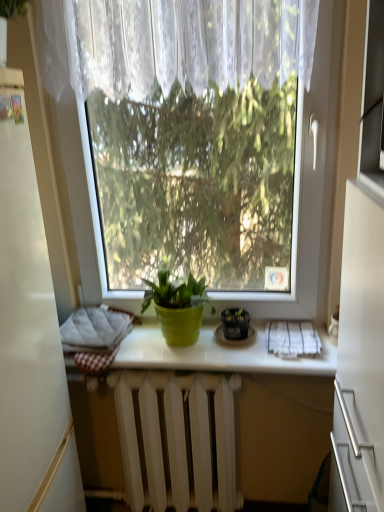
Question: Which direction should I rotate to face green matte pot at center, which is the 1th houseplant from left to right, — up or down?

Choices:
 (A) up
 (B) down

Answer: (B)

Question: Can you confirm if white textured cloth at lower right is taller than green matte pot at center, which is the 1th houseplant from left to right?

Choices:
 (A) yes
 (B) no

Answer: (B)

Question: Does white textured cloth at lower right have a larger size compared to green matte pot at center, which is counted as the second houseplant, starting from the right?

Choices:
 (A) yes
 (B) no

Answer: (B)

Question: Is white textured cloth at lower right in front of green matte pot at center, which is counted as the second houseplant, starting from the right?

Choices:
 (A) no
 (B) yes

Answer: (A)

Question: Is white textured cloth at lower right facing towards green matte pot at center, which is counted as the second houseplant, starting from the right?

Choices:
 (A) no
 (B) yes

Answer: (A)

Question: From the image's perspective, is white textured cloth at lower right on top of green matte pot at center, which is the 1th houseplant from left to right?

Choices:
 (A) yes
 (B) no

Answer: (B)

Question: Can you confirm if white textured cloth at lower right is positioned to the left of green matte pot at center, which is counted as the second houseplant, starting from the right?

Choices:
 (A) yes
 (B) no

Answer: (B)

Question: From a real-world perspective, is white painted metal radiator at center beneath green matte pot at center, which is counted as the second houseplant, starting from the right?

Choices:
 (A) no
 (B) yes

Answer: (B)

Question: Considering the relative positions of white painted metal radiator at center and green matte pot at center, which is the 1th houseplant from left to right, in the image provided, is white painted metal radiator at center in front of green matte pot at center, which is the 1th houseplant from left to right,?

Choices:
 (A) yes
 (B) no

Answer: (B)

Question: Can you confirm if white painted metal radiator at center is bigger than green matte pot at center, which is the 1th houseplant from left to right?

Choices:
 (A) yes
 (B) no

Answer: (A)

Question: Is the position of white painted metal radiator at center more distant than that of green matte pot at center, which is the 1th houseplant from left to right?

Choices:
 (A) no
 (B) yes

Answer: (B)

Question: Is green matte pot at center, which is the 1th houseplant from left to right, completely or partially inside white painted metal radiator at center?

Choices:
 (A) yes
 (B) no

Answer: (B)

Question: Considering the relative sizes of white painted metal radiator at center and green matte pot at center, which is counted as the second houseplant, starting from the right, in the image provided, is white painted metal radiator at center smaller than green matte pot at center, which is counted as the second houseplant, starting from the right,?

Choices:
 (A) yes
 (B) no

Answer: (B)

Question: Can you confirm if matte black pot at center, which is the first houseplant from right to left, is thinner than white textured cloth at lower right?

Choices:
 (A) no
 (B) yes

Answer: (B)